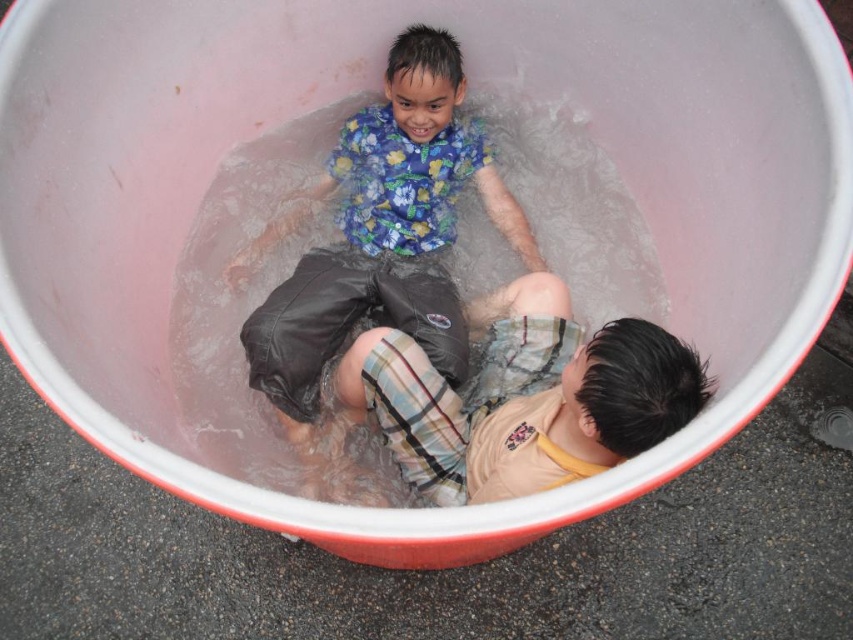
Is point (424, 186) positioned before point (711, 390)?

No.

Measure the distance between floral fabric shirt at upper center and plaid cotton shorts at lower right.

floral fabric shirt at upper center and plaid cotton shorts at lower right are 11.93 inches apart.

Who is more distant from viewer, (x=392, y=307) or (x=428, y=387)?

The point (x=392, y=307) is more distant.

Locate an element on the screen. The height and width of the screenshot is (640, 853). floral fabric shirt at upper center is located at coordinates (378, 246).